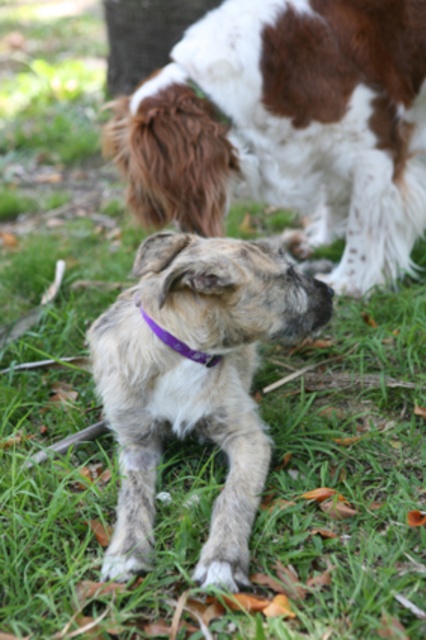
You are standing in the park and want to walk from the point at coordinates point [310,324] to the point at coordinates point [164,340]. Which direction should you move relative to your current position?

You should move downward and to the right because point [164,340] is located below and to the right of point [310,324].

You are holding a 3.5 feet wide blanket and want to cover the fuzzy gray dog at center. Can you determine if the blanket will fit over the dog?

The fuzzy gray dog at center is 5.72 feet away from the camera, but the distance doesn t indicate the dog s size. Without knowing the dog s actual size, it s impossible to determine if the 3.5 feet wide blanket will fit over it.

You are a photographer trying to capture a clear shot of the fuzzy gray dog at center and the purple fabric neckband at center. Since you want both subjects in focus, which one should you adjust your camera focus on first?

The fuzzy gray dog at center is closer to the viewer than the purple fabric neckband at center, so you should focus on the fuzzy gray dog at center first to ensure both are in focus.